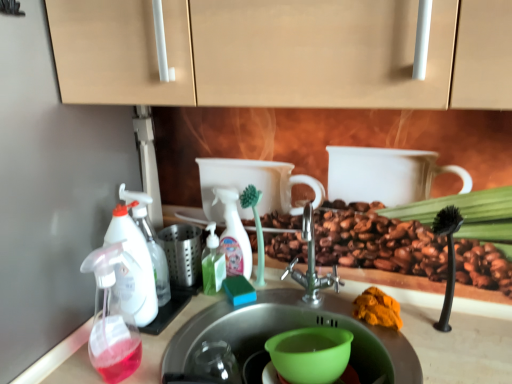
You are a GUI agent. You are given a task and a screenshot of the screen. Output one action in this format:
    pyautogui.click(x=<x>, y=<y>)
    Task: Click on the free space in front of green translucent soap dispenser at center, marked as the first soap dispenser in a right-to-left arrangement
    The height and width of the screenshot is (384, 512).
    Given the screenshot: What is the action you would take?
    pyautogui.click(x=200, y=320)